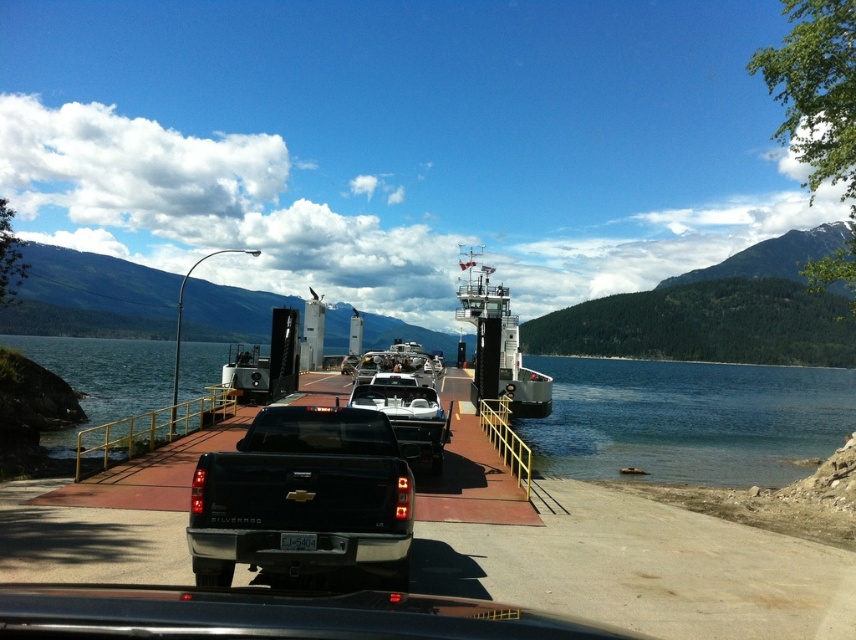
Question: Is black matte truck at center bigger than metallic silver boat at center?

Choices:
 (A) yes
 (B) no

Answer: (A)

Question: Which is nearer to the black matte truck at center?

Choices:
 (A) metallic silver boat at center
 (B) clear water at center
 (C) metallic gray boat at center

Answer: (A)

Question: Observing the image, what is the correct spatial positioning of clear water at center in reference to metallic silver boat at center?

Choices:
 (A) above
 (B) below

Answer: (B)

Question: Among these objects, which one is farthest from the camera?

Choices:
 (A) metallic gray boat at center
 (B) metallic silver boat at center
 (C) clear water at center
 (D) clear blue water at center

Answer: (A)

Question: Is clear water at center thinner than metallic gray boat at center?

Choices:
 (A) yes
 (B) no

Answer: (B)

Question: Which of the following is the farthest from the observer?

Choices:
 (A) (664, 477)
 (B) (544, 392)
 (C) (79, 428)
 (D) (373, 403)

Answer: (C)